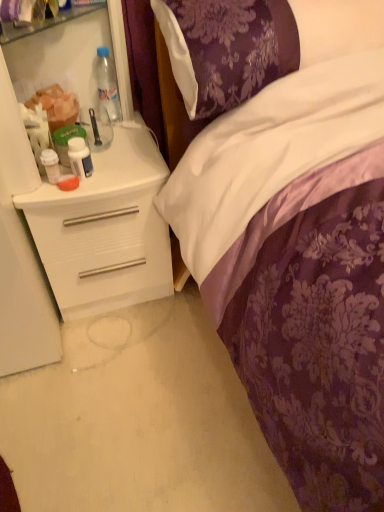
Question: From the image's perspective, is white glossy pill bottle at left, the 2th bottle when ordered from back to front, above or below clear plastic bottle at upper left, which appears as the third bottle when ordered from the bottom?

Choices:
 (A) below
 (B) above

Answer: (A)

Question: In the image, is white glossy pill bottle at left, the 2th bottle when ordered from back to front, positioned in front of or behind clear plastic bottle at upper left, the 1th bottle viewed from the back?

Choices:
 (A) front
 (B) behind

Answer: (A)

Question: Considering the real-world distances, which object is closest to the white plastic desk at left?

Choices:
 (A) white plastic cup at left, the 3th bottle from the back
 (B) purple satin pillow at upper center
 (C) clear plastic bottle at upper left, the 1th bottle viewed from the back
 (D) white glossy pill bottle at left, the 2th bottle when ordered from back to front
 (E) translucent plastic cup at left

Answer: (D)

Question: Which object is positioned closest to the translucent plastic cup at left?

Choices:
 (A) white plastic cup at left, the first bottle ordered from the bottom
 (B) white plastic desk at left
 (C) white glossy pill bottle at left, the second bottle in the left-to-right sequence
 (D) clear plastic bottle at upper left, the 3th bottle from the left
 (E) purple satin pillow at upper center

Answer: (A)